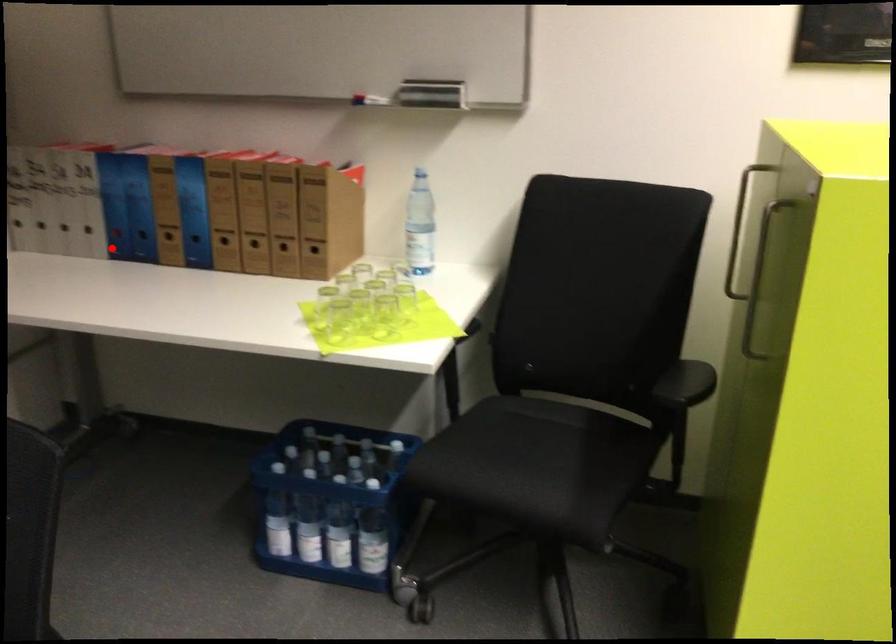
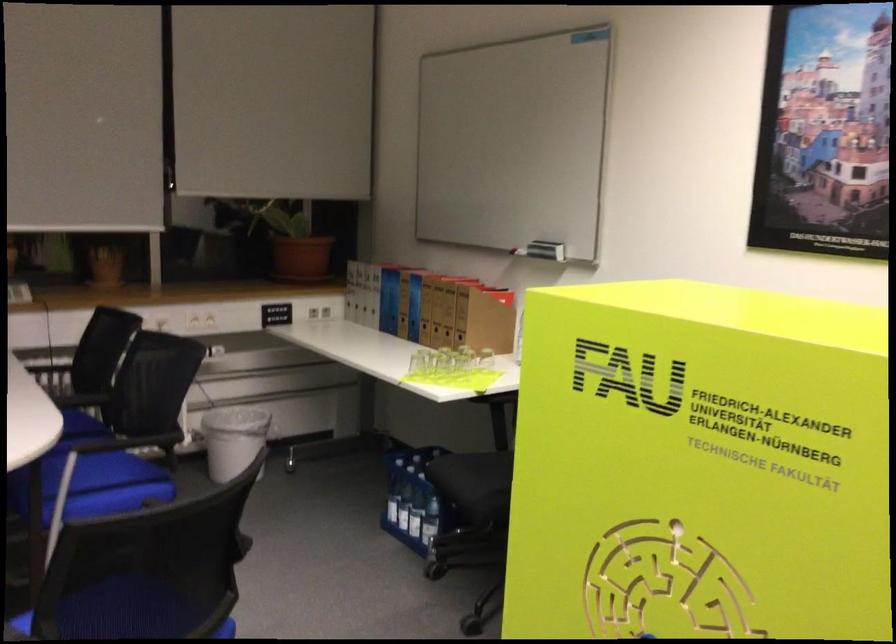
Question: I am providing you with two images of the same scene from different viewpoints. Given a red point in image1, look at the same physical point in image2. Is it:

Choices:
 (A) Closer to the viewpoint
 (B) Farther from the viewpoint

Answer: (B)